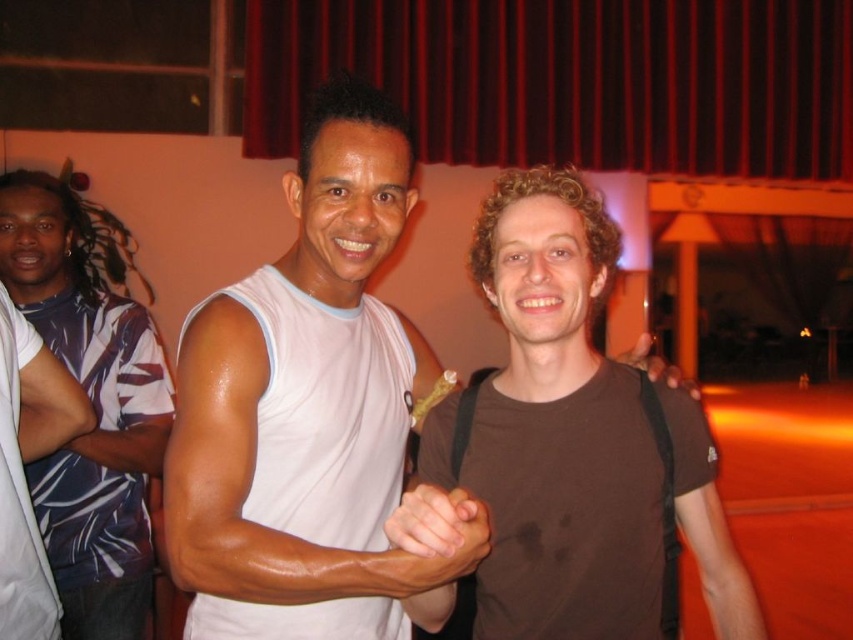
You are taking a photo of the scene. The two points in the image are located at coordinates point (33, 308) and point (100, 396). Which point is closer to the camera?

Point (33, 308) is further to the camera than point (100, 396).

You are standing at the point marked as point [184,433]. You want to greet the person wearing the sleeveless white tank top. Can you reach them without moving from your current position?

The distance between you and the person wearing the sleeveless white tank top is 38.48 inches. Since you can typically reach about 24 inches without moving, you cannot reach them without moving from your current position.